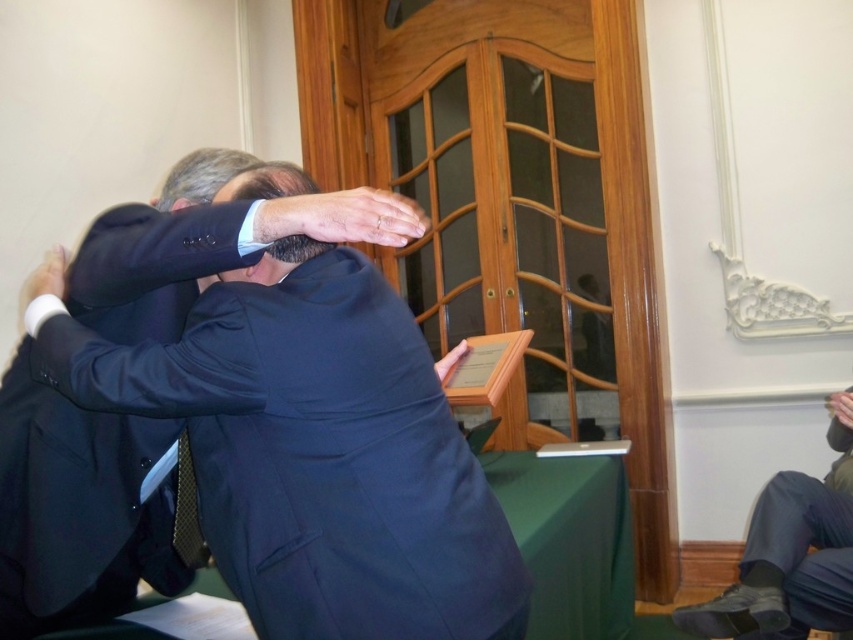
You are standing in the conference room and want to take a photo. There are two points marked in the image, point (x=141, y=380) and point (x=170, y=195). Which point should you focus on to ensure the subject in the foreground is sharp?

Point (x=141, y=380) is closer to the camera than point (x=170, y=195), so focusing on point (x=141, y=380) will ensure the foreground subject is sharp.